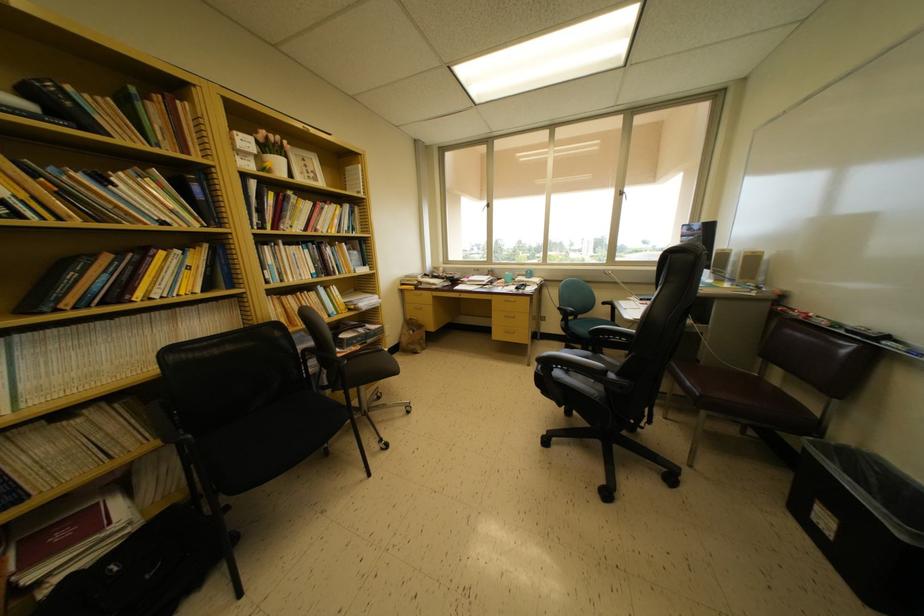
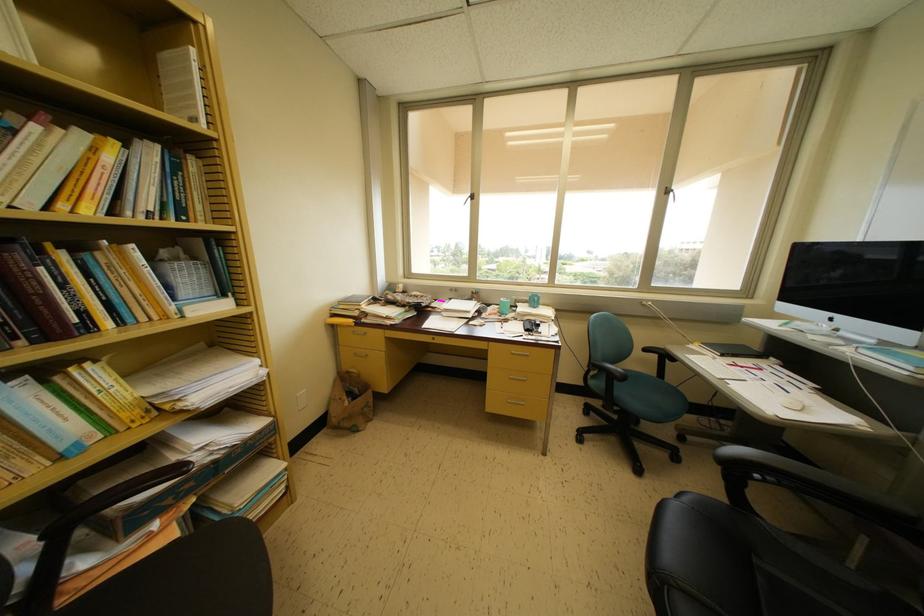
In the second image, find the point that corresponds to point 625,196 in the first image.

(671, 193)